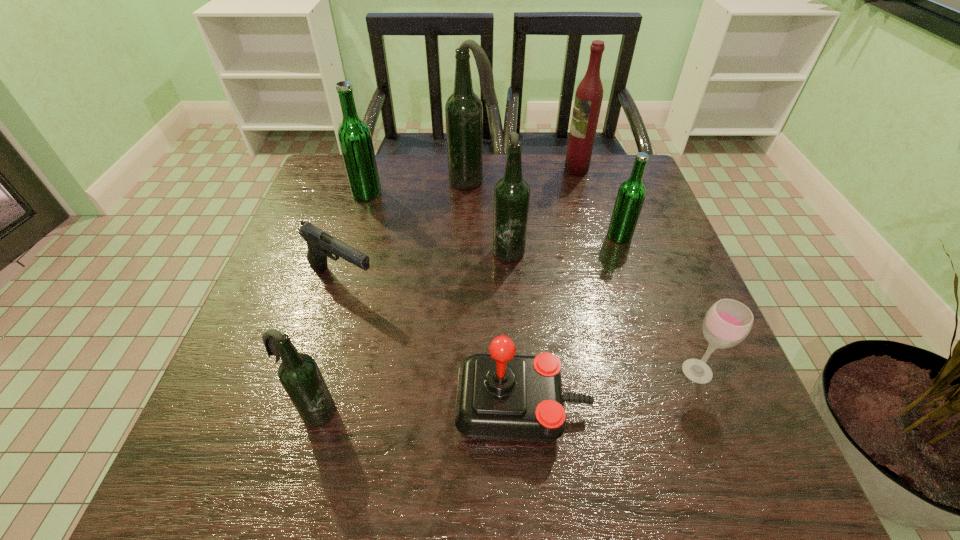
You are a GUI agent. You are given a task and a screenshot of the screen. Output one action in this format:
    pyautogui.click(x=<x>, y=<y>)
    Task: Click on the farthest dark beer bottle
    
    Given the screenshot: What is the action you would take?
    pyautogui.click(x=463, y=111)

Where is `the tallest beer bottle`? This screenshot has width=960, height=540. the tallest beer bottle is located at coordinates (463, 111).

Where is `dark liquor`? This screenshot has height=540, width=960. dark liquor is located at coordinates pyautogui.click(x=589, y=94).

I want to click on the bigger green beer bottle, so click(x=354, y=136).

At what (x,y) coordinates should I click in order to perform the action: click on the farther green beer bottle. Please return your answer as a coordinate pair (x, y). This screenshot has width=960, height=540. Looking at the image, I should click on (354, 136).

Locate an element on the screen. This screenshot has height=540, width=960. the second smallest dark beer bottle is located at coordinates (512, 193).

Image resolution: width=960 pixels, height=540 pixels. Identify the location of the smaller green beer bottle. (631, 194).

In order to click on the rightmost beer bottle in this screenshot , I will do `click(631, 194)`.

At what (x,y) coordinates should I click in order to perform the action: click on the leftmost dark beer bottle. Please return your answer as a coordinate pair (x, y). Image resolution: width=960 pixels, height=540 pixels. Looking at the image, I should click on (299, 374).

Locate an element on the screen. This screenshot has height=540, width=960. the nearest beer bottle is located at coordinates (299, 374).